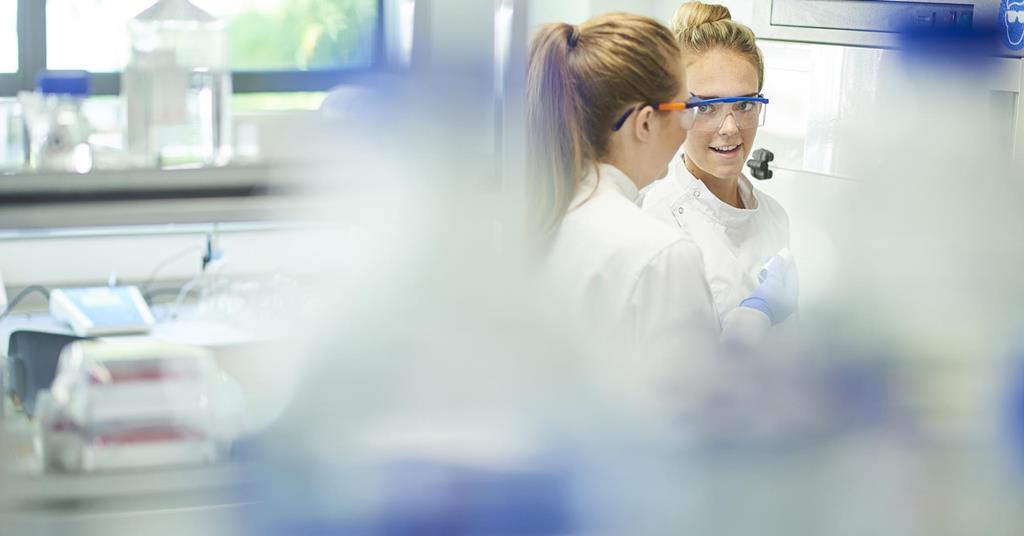
The height and width of the screenshot is (536, 1024). I want to click on window, so click(x=293, y=18).